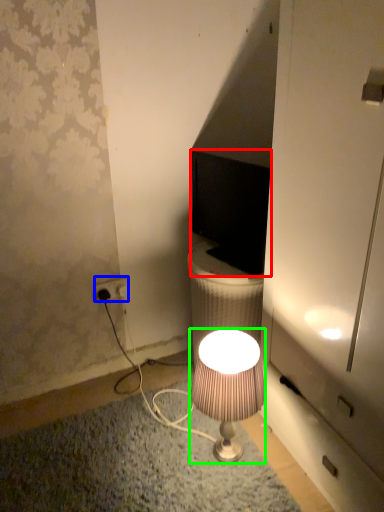
Question: Estimate the real-world distances between objects in this image. Which object is closer to computer monitor (highlighted by a red box), power outlet (highlighted by a blue box) or lamp (highlighted by a green box)?

Choices:
 (A) power outlet
 (B) lamp

Answer: (B)